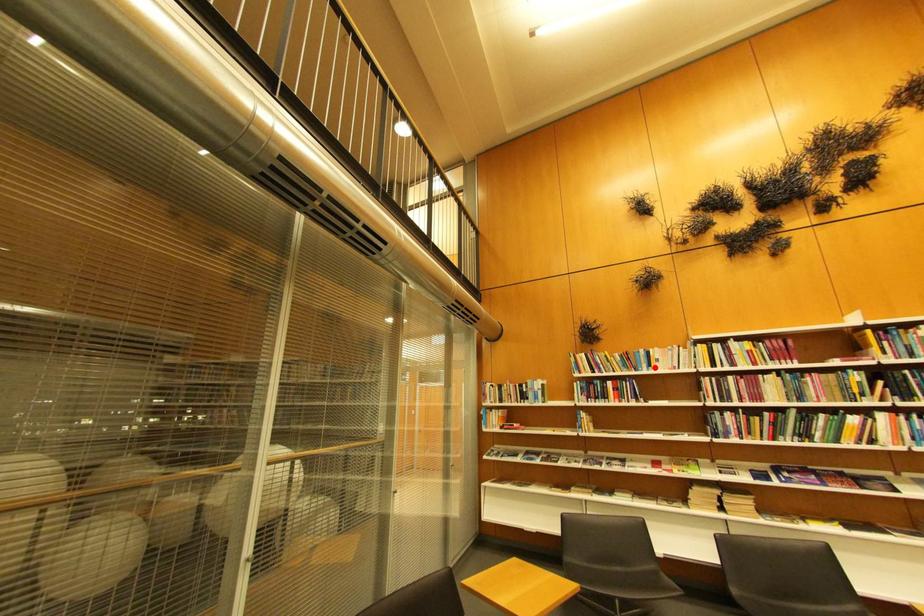
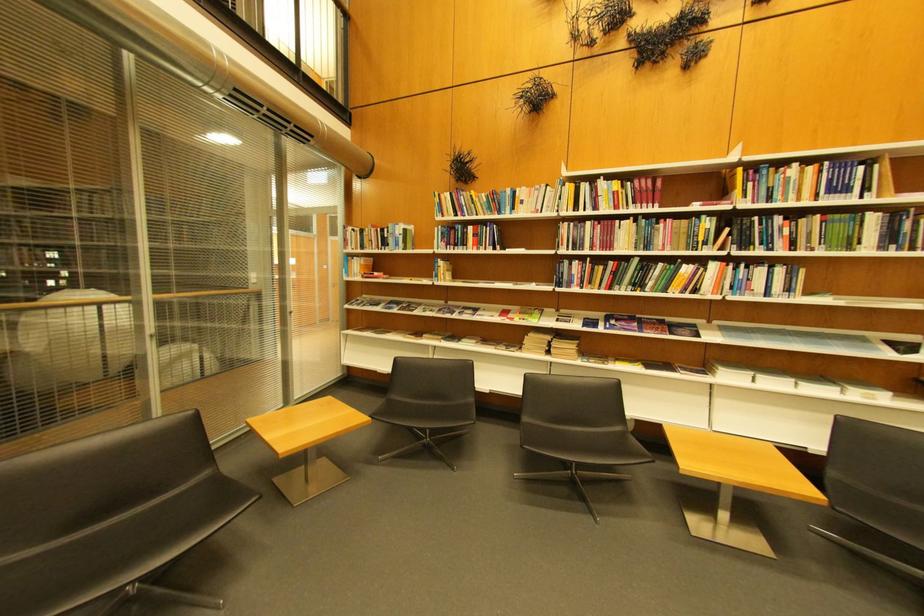
Where in the second image is the point corresponding to the highlighted location from the first image?

(518, 209)